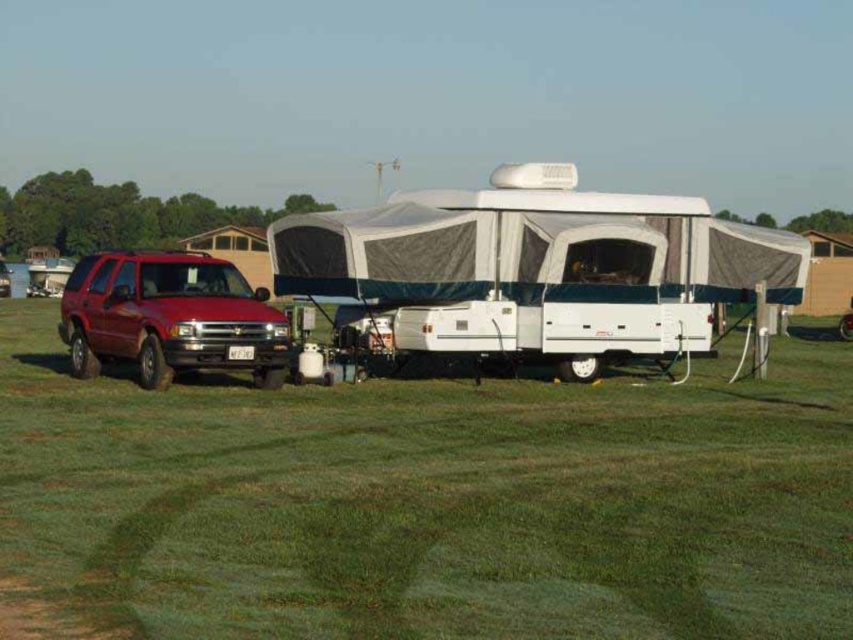
You are standing in the outdoor area and want to take a photo of both the white fabric tent at center and the matte red suv at left. Which object should you position closer to the camera to ensure both are in focus?

You should position the white fabric tent at center closer to the camera since it is closer to the viewer than the matte red suv at left. This way, both objects will be in focus as they will be at similar distances from the camera.

You are planning to set up a tent in the green grassy field at center. The matte red suv at left is parked nearby. Considering the space available, will the tent fit if it requires an area wider than the SUV?

The green grassy field at center has a width larger than the matte red suv at left, so yes, the tent requiring an area wider than the SUV can fit in the green grassy field at center.